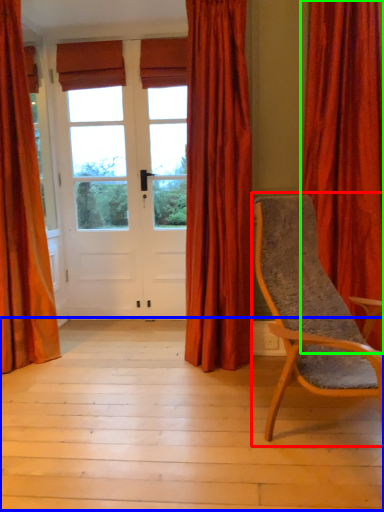
Question: Which is nearer to the chair (highlighted by a red box)? porch (highlighted by a blue box) or curtain (highlighted by a green box).

Choices:
 (A) porch
 (B) curtain

Answer: (A)